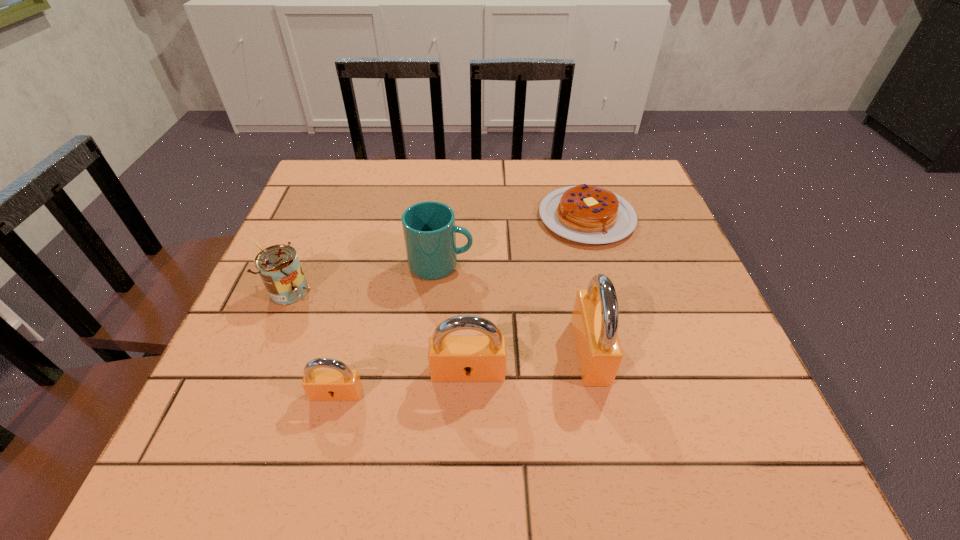
The padlocks are evenly distributed in the image. To maintain this, where would you place another padlock on the right? Please point to a free space. Please provide its 2D coordinates. Your answer should be formatted as a tuple, i.e. [(x, y)], where the tuple contains the x and y coordinates of a point satisfying the conditions above.

[(703, 333)]